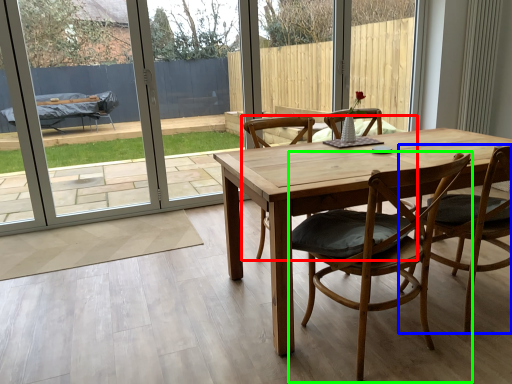
Question: Which object is positioned closest to chair (highlighted by a red box)? Select from chair (highlighted by a blue box) and chair (highlighted by a green box).

Choices:
 (A) chair
 (B) chair

Answer: (A)